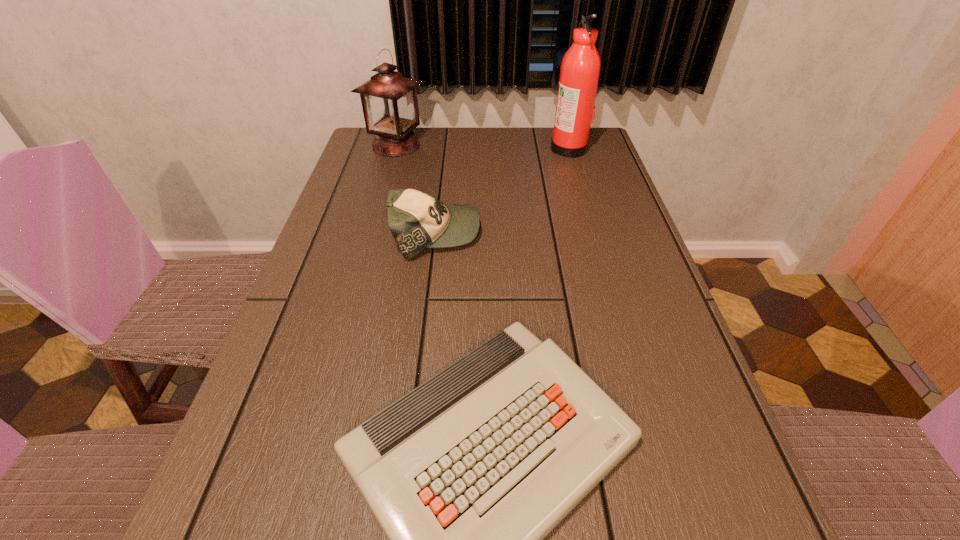
This screenshot has width=960, height=540. I want to click on oil lamp at the far edge, so click(x=389, y=101).

Image resolution: width=960 pixels, height=540 pixels. Identify the location of oil lamp that is at the left edge. (389, 101).

This screenshot has height=540, width=960. I want to click on baseball cap positioned at the left edge, so click(417, 221).

Locate an element on the screen. Image resolution: width=960 pixels, height=540 pixels. object present at the right edge is located at coordinates (580, 69).

Where is `object that is at the far left corner`? This screenshot has height=540, width=960. object that is at the far left corner is located at coordinates (389, 101).

Identify the location of object that is at the far right corner. The width and height of the screenshot is (960, 540). (580, 69).

Identify the location of vacant region at the far edge of the desktop. (540, 140).

The image size is (960, 540). Find the location of `vacant space at the left edge`. vacant space at the left edge is located at coordinates (377, 281).

In the image, there is a desktop. Find the location of `free space at the right edge`. free space at the right edge is located at coordinates (667, 345).

This screenshot has height=540, width=960. Find the location of `blank area at the far left corner`. blank area at the far left corner is located at coordinates (353, 165).